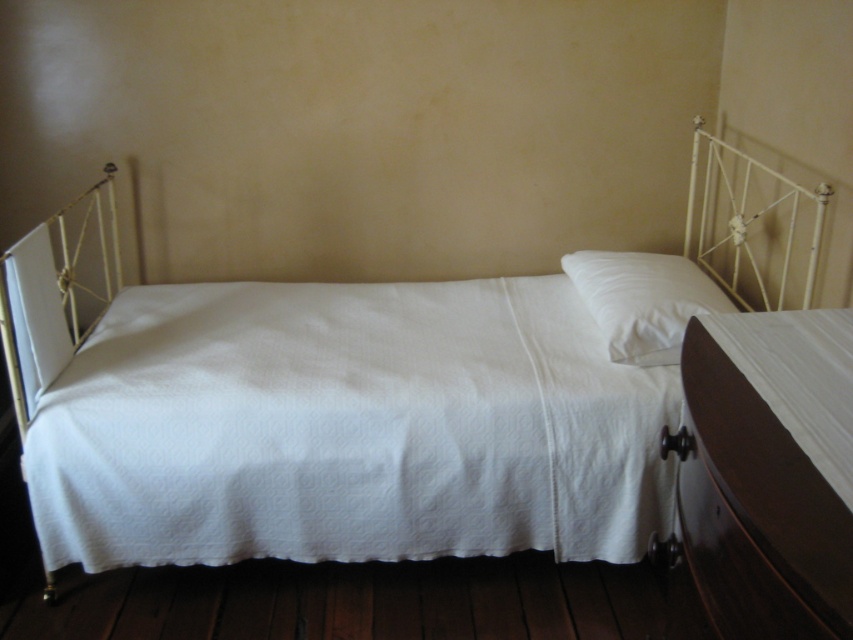
You are a delivery person who needs to place a rectangular package that is 30 inches long between the white quilted fabric at center and the white metal headboard at upper right. Can the package fit in the space between them?

The distance between the white quilted fabric at center and the white metal headboard at upper right is 33.05 inches. Since the package is 30 inches long, it can fit in the space between them as there is enough length available.

Please provide the coordinates of the white quilted fabric at center in the image.

The white quilted fabric at center is located at coordinates point (347,428).